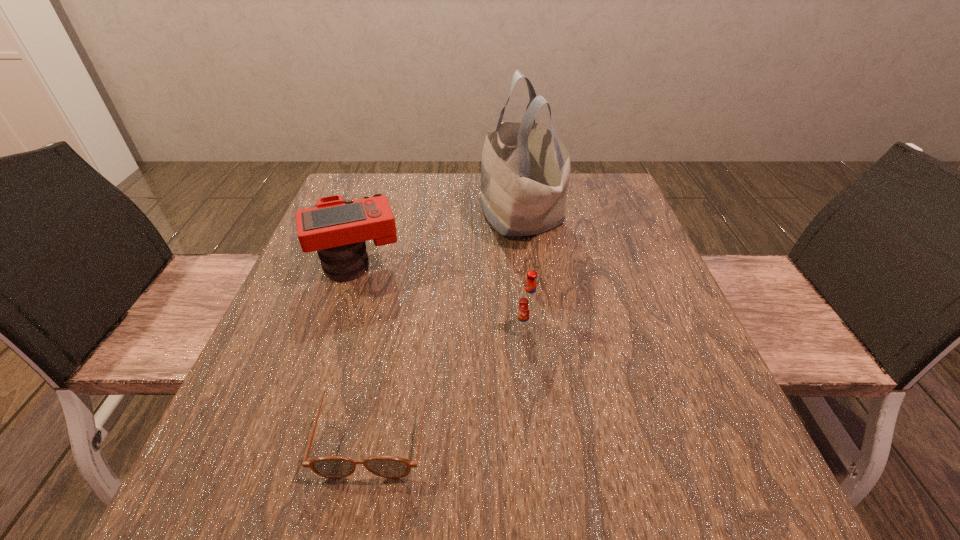
The width and height of the screenshot is (960, 540). I want to click on the tallest object, so click(525, 170).

Locate an element on the screen. camera is located at coordinates (337, 229).

The image size is (960, 540). Identify the location of the second nearest object. (529, 302).

Identify the location of sunglasses. The width and height of the screenshot is (960, 540). (334, 467).

Locate an element on the screen. Image resolution: width=960 pixels, height=540 pixels. the nearest object is located at coordinates (334, 467).

Where is `free space located 0.170m on the right of the shopping bag`? free space located 0.170m on the right of the shopping bag is located at coordinates pyautogui.click(x=625, y=213).

At what (x,y) coordinates should I click in order to perform the action: click on free space located on the front of the camera. Please return your answer as a coordinate pair (x, y). This screenshot has width=960, height=540. Looking at the image, I should click on (311, 402).

Where is `free space located on the right of the root beer`? This screenshot has height=540, width=960. free space located on the right of the root beer is located at coordinates (603, 328).

What are the coordinates of `object at the far edge` in the screenshot? It's located at (525, 170).

Image resolution: width=960 pixels, height=540 pixels. Identify the location of object that is positioned at the near edge. (334, 467).